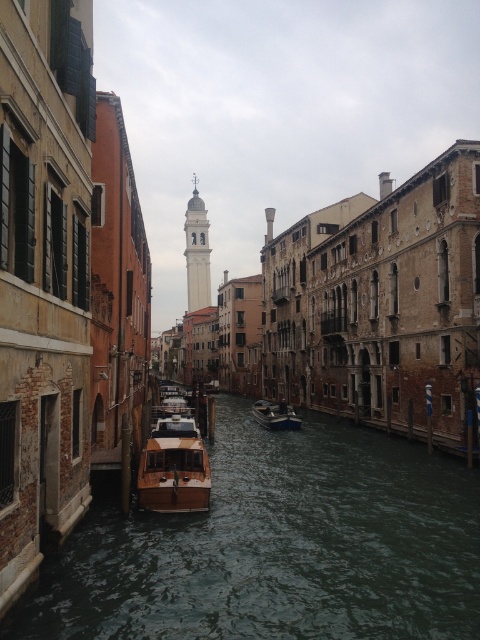
You are standing at the edge of the canal and want to throw a coin into the greenish water at center. Based on the coordinates provided, can you determine if the water is located in the lower or upper half of the image?

The greenish water at center is located at point coordinates with a y value of 0.579. Since the y value is above 0.5, it is in the upper half of the image.

You are a tourist standing on the left side of the canal and want to take a photo of the wooden polished boat at center and the greenish water at center. Which object should you frame first in your camera viewfinder to ensure both are captured?

You should frame the wooden polished boat at center first since it is to the left of the greenish water at center, ensuring both are included in the photo.

You are a tourist standing on the left side of the canal and want to take a photo of the white marble bell tower at center and the greenish water at center. Given that your camera can focus on objects up to 1000 feet away, will you be able to capture both in one shot?

The white marble bell tower at center and greenish water at center are 1163.57 feet apart. Since the camera can only focus up to 1000 feet, you won answer. The distance between them is 1163.57 feet, which exceeds the camera